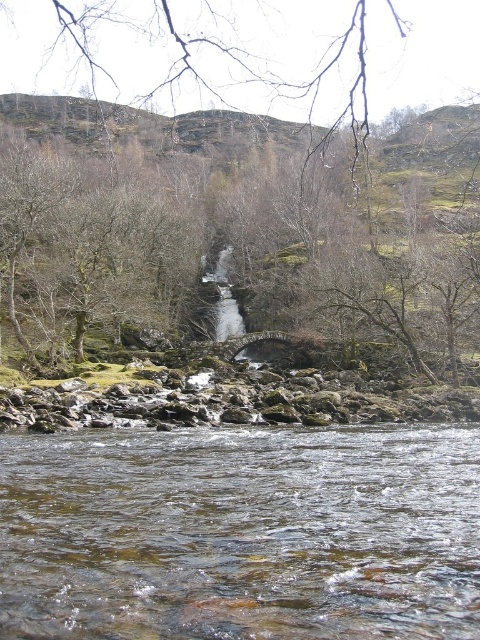
Between brown leafless tree at center and clear water at center, which one is positioned lower?

Positioned lower is clear water at center.

Which is behind, point (112, 248) or point (211, 541)?

The point (112, 248) is behind.

The width and height of the screenshot is (480, 640). Identify the location of brown leafless tree at center. (233, 228).